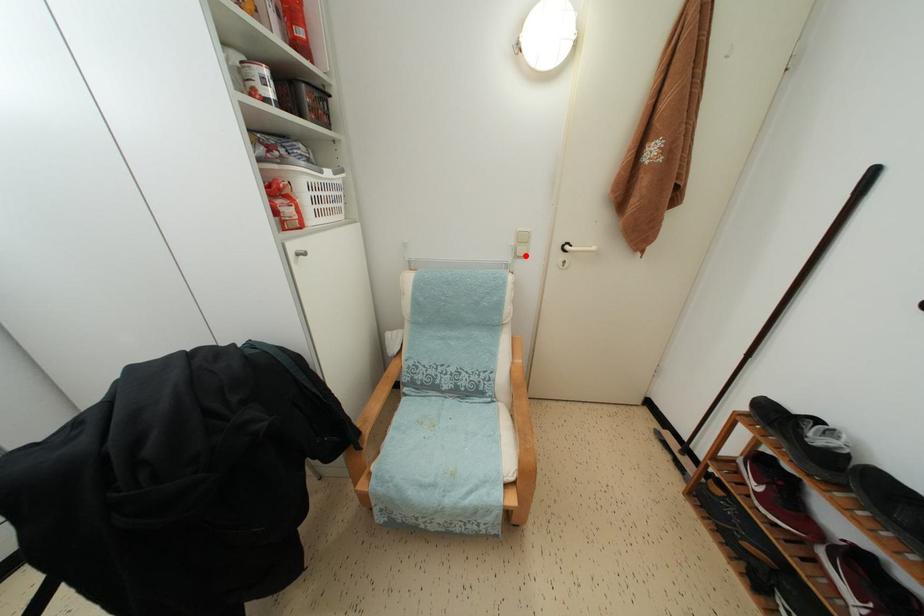
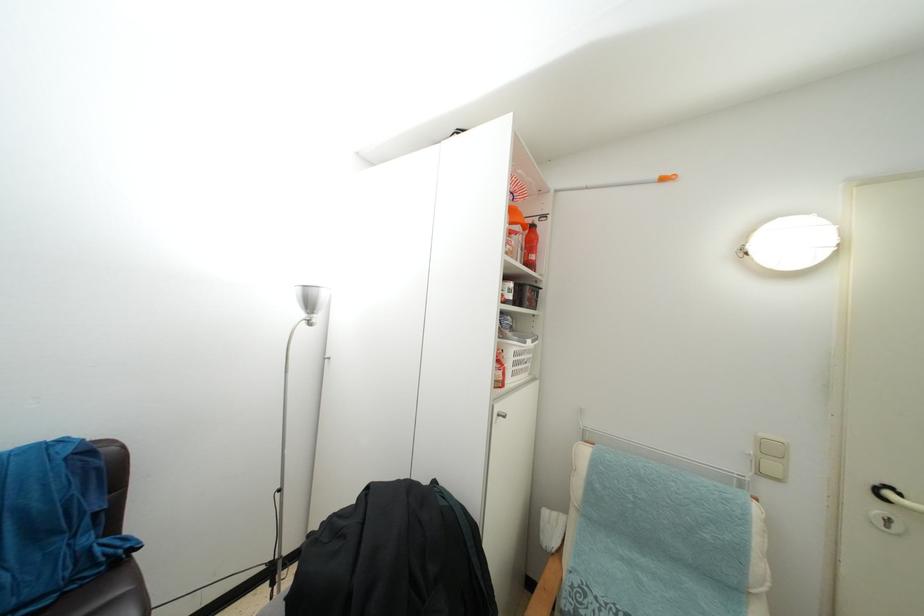
In the second image, find the point that corresponds to the highlighted location in the first image.

(775, 472)